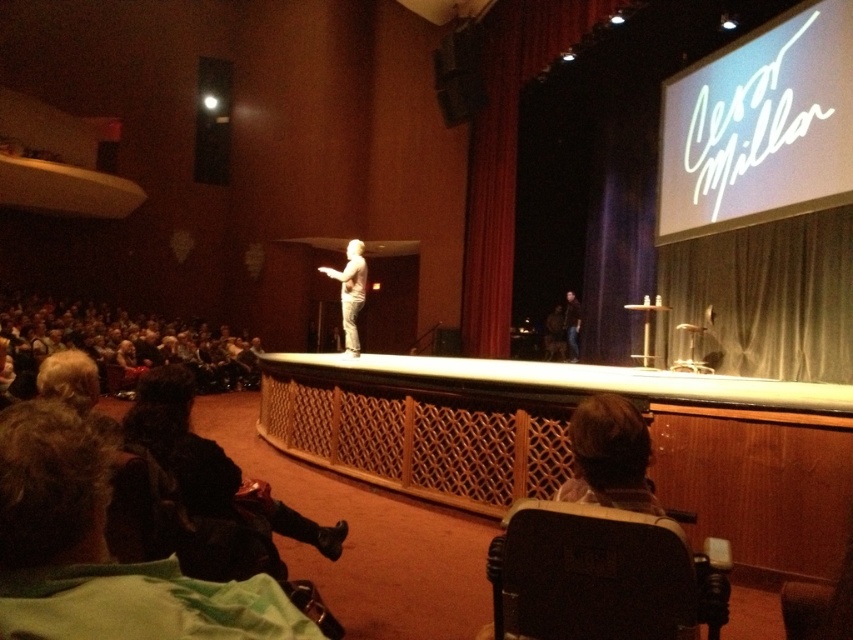
Between matte black speaker at upper center and dark gray jeans at center, which one appears on the left side from the viewer's perspective?

matte black speaker at upper center is more to the left.

Measure the distance between matte black speaker at upper center and camera.

They are 13.48 meters apart.

Where is `matte black speaker at upper center`? matte black speaker at upper center is located at coordinates (459, 74).

Identify the location of matte black speaker at upper left. This screenshot has height=640, width=853. tap(212, 122).

Between matte black speaker at upper left and smooth white statue at center, which one is positioned higher?

Positioned higher is matte black speaker at upper left.

Does point (225, 72) come farther from viewer compared to point (355, 268)?

Yes, it is behind point (355, 268).

Where is `matte black speaker at upper left`? Image resolution: width=853 pixels, height=640 pixels. matte black speaker at upper left is located at coordinates (212, 122).

Between point (213, 70) and point (479, 45), which one is positioned behind?

Positioned behind is point (213, 70).

Which of these two, matte black speaker at upper left or matte black speaker at upper center, stands shorter?

Standing shorter between the two is matte black speaker at upper center.

Does point (224, 179) come farther from viewer compared to point (440, 93)?

Yes.

The width and height of the screenshot is (853, 640). What are the coordinates of `matte black speaker at upper left` in the screenshot? It's located at (212, 122).